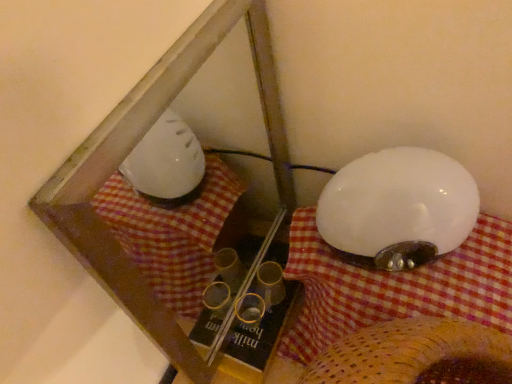
Question: Which is correct: transparent plastic glass box at center is inside white glossy lampshade at right, or outside of it?

Choices:
 (A) outside
 (B) inside

Answer: (A)

Question: Considering the positions of transparent plastic glass box at center and white glossy lampshade at right in the image, is transparent plastic glass box at center wider or thinner than white glossy lampshade at right?

Choices:
 (A) wide
 (B) thin

Answer: (B)

Question: Estimate the real-world distances between objects in this image. Which object is farther from the transparent plastic glass box at center?

Choices:
 (A) white fabric at upper right
 (B) white glossy lampshade at right

Answer: (B)

Question: Which is farther from the white fabric at upper right?

Choices:
 (A) transparent plastic glass box at center
 (B) white glossy lampshade at right

Answer: (A)